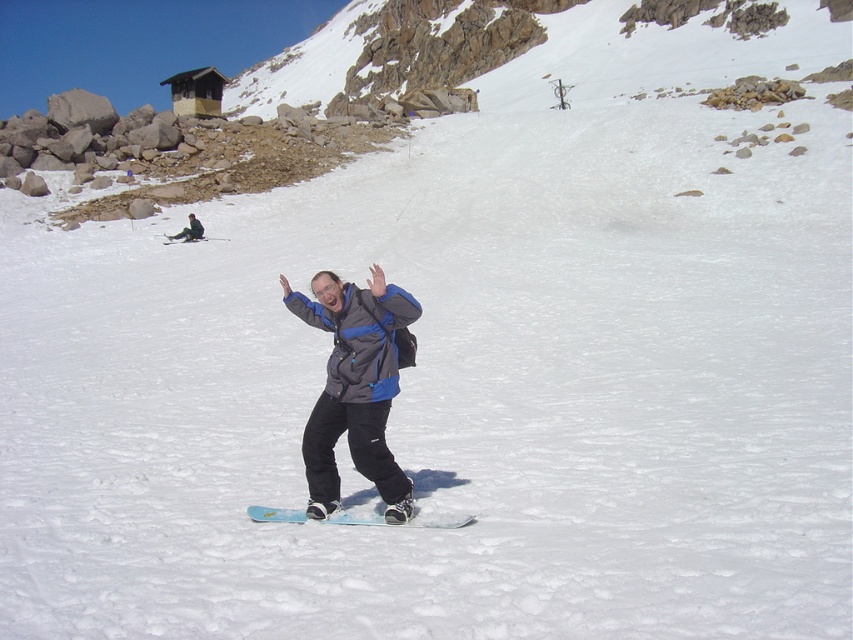
Is point (360, 513) in front of point (192, 221)?

Yes, it is.

Does blue plastic snowboard at center have a larger size compared to gray fabric jacket at upper center?

No, blue plastic snowboard at center is not bigger than gray fabric jacket at upper center.

Who is more distant from viewer, (418, 516) or (183, 236)?

Positioned behind is point (183, 236).

Image resolution: width=853 pixels, height=640 pixels. Identify the location of blue plastic snowboard at center. (439, 518).

Which is behind, point (183, 234) or point (204, 237)?

Point (204, 237)

Can you confirm if gray fabric jacket at upper center is shorter than blue matte snowboard at upper center?

No.

Between point (196, 240) and point (183, 241), which one is positioned behind?

The point (196, 240) is behind.

This screenshot has width=853, height=640. I want to click on gray fabric jacket at upper center, so click(x=189, y=230).

Who is higher up, blue matte snowboard at center or gray fabric jacket at upper center?

gray fabric jacket at upper center is above.

Is blue matte snowboard at center above gray fabric jacket at upper center?

No.

Which is behind, point (375, 518) or point (186, 227)?

Positioned behind is point (186, 227).

Identify the location of blue matte snowboard at center. The width and height of the screenshot is (853, 640). (357, 397).